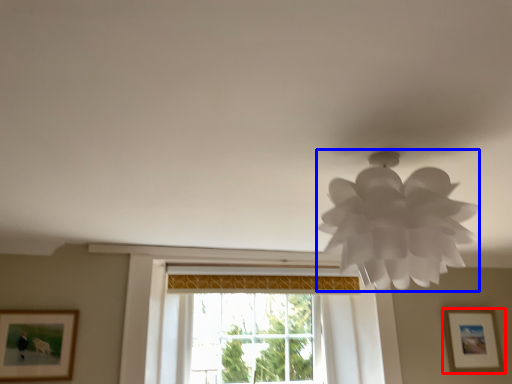
Question: Which object appears farthest to the camera in this image, picture frame (highlighted by a red box) or lamp (highlighted by a blue box)?

Choices:
 (A) picture frame
 (B) lamp

Answer: (A)